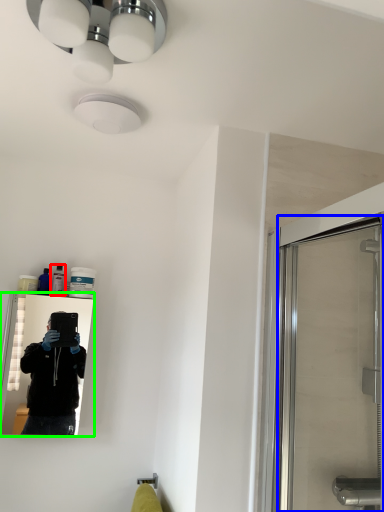
Question: Which is farther away from toiletry (highlighted by a red box)? screen door (highlighted by a blue box) or mirror (highlighted by a green box)?

Choices:
 (A) screen door
 (B) mirror

Answer: (B)